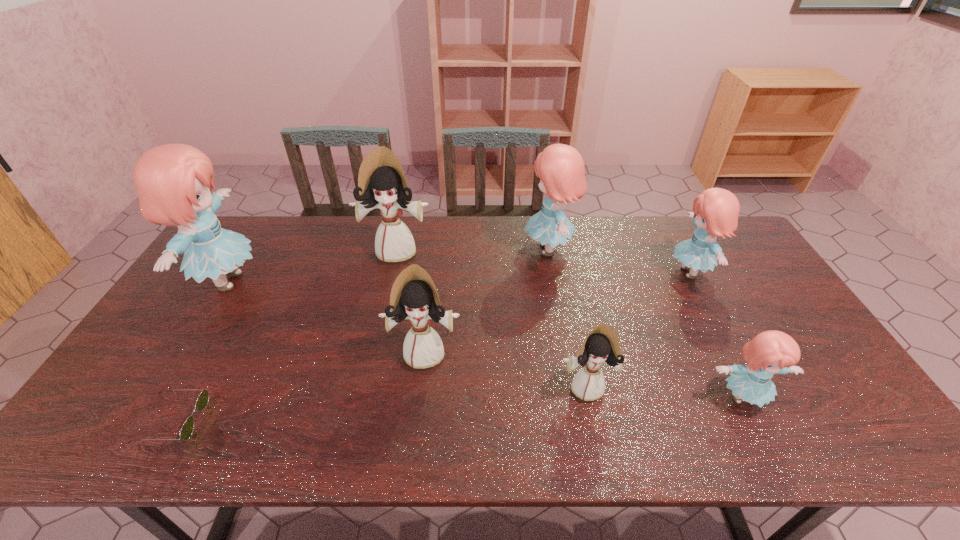
Where is `vacant area located on the front-facing side of the green sunglasses`? The image size is (960, 540). vacant area located on the front-facing side of the green sunglasses is located at coordinates (362, 420).

Locate an element on the screen. The height and width of the screenshot is (540, 960). doll present at the near edge is located at coordinates (771, 352).

Where is `sunglasses situated at the near edge`? Image resolution: width=960 pixels, height=540 pixels. sunglasses situated at the near edge is located at coordinates (187, 429).

The image size is (960, 540). Find the location of `doll that is at the left edge`. doll that is at the left edge is located at coordinates (173, 181).

At what (x,y) coordinates should I click in order to perform the action: click on sunglasses at the left edge. Please return your answer as a coordinate pair (x, y). Image resolution: width=960 pixels, height=540 pixels. Looking at the image, I should click on (187, 429).

You are a GUI agent. You are given a task and a screenshot of the screen. Output one action in this format:
    pyautogui.click(x=<x>, y=<y>)
    Task: Click on the object at the right edge
    
    Given the screenshot: What is the action you would take?
    pyautogui.click(x=716, y=210)

Locate an element on the screen. The width and height of the screenshot is (960, 540). object that is at the far left corner is located at coordinates [173, 181].

Where is `object situated at the near left corner`? object situated at the near left corner is located at coordinates (187, 429).

What are the coordinates of `object that is at the far right corner` in the screenshot? It's located at (716, 210).

Identify the location of vacant space at the far edge of the desktop. pyautogui.click(x=350, y=252).